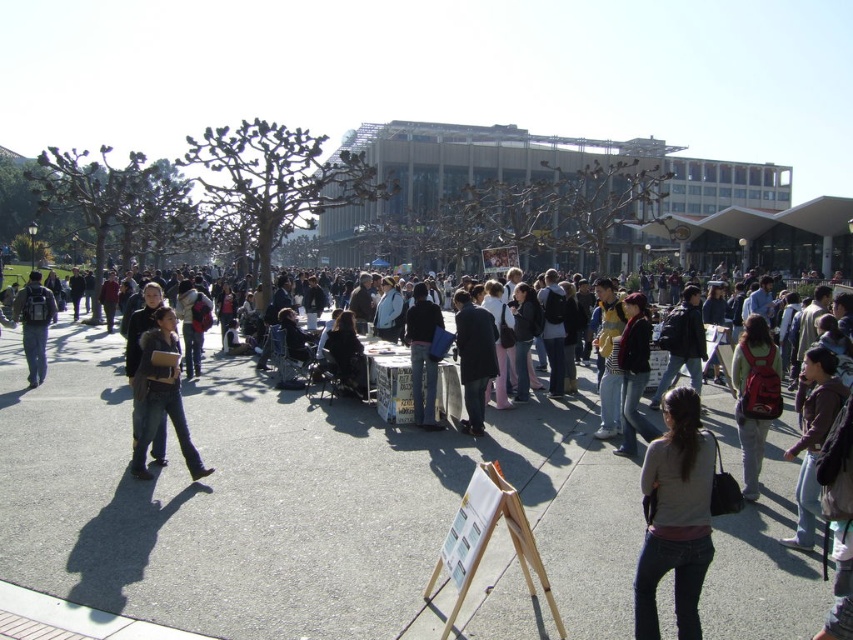
You are standing at the point with coordinates point (820, 348) and want to walk towards the point with coordinates point (759, 436). According to the scene, will you have to walk forward or backward?

Since point (820, 348) is in front of point (759, 436), you would need to walk backward to move towards point (759, 436).